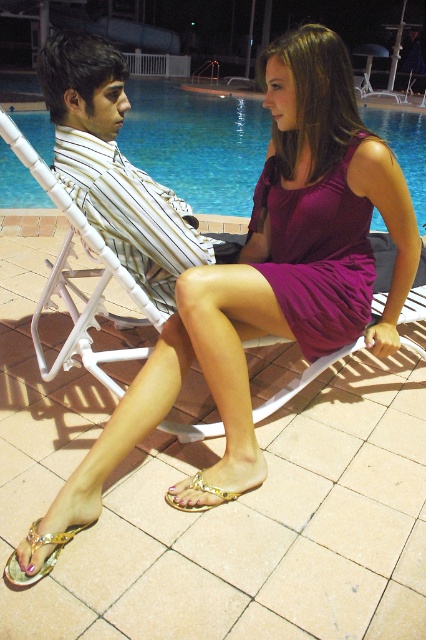
In the scene shown: You are a lifeguard standing at the edge of the blue glass swimming pool at center and need to retrieve the gold metallic sandal at lower left. Can you reach it without leaving the pool area?

The blue glass swimming pool at center might be wider than the gold metallic sandal at lower left, so it is uncertain if you can reach it without leaving the pool area. You may need to check the exact dimensions.

You are a guest at the resort and want to place your gold metallic sandal at lower left on the edge of the blue glass swimming pool at center. Is the sandal positioned in a way that allows it to be placed there without moving it?

The blue glass swimming pool at center is above the gold metallic sandal at lower left, so the sandal is already positioned under the pool. To place it on the edge, you would need to move it upwards to the pool.